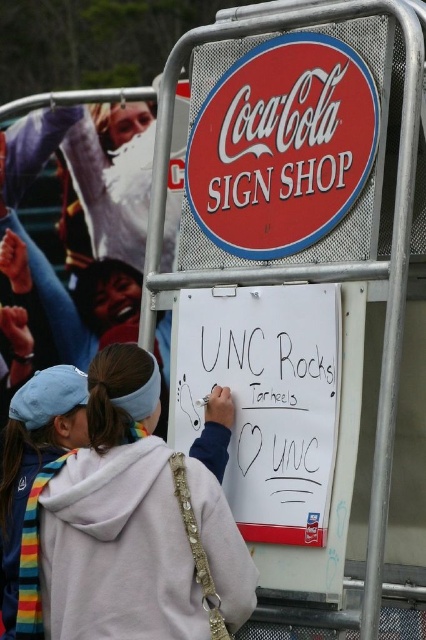
Consider the image. You are at an outdoor event and see a person wearing a white fleece hoodie at center and a white paperboard at center. Which object is positioned to the left?

The white fleece hoodie at center is to the left of the white paperboard at center.